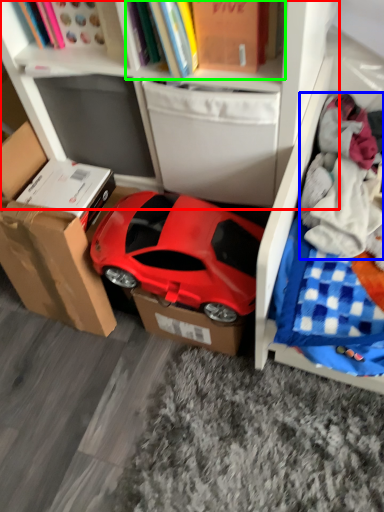
Question: Based on their relative distances, which object is farther from bookcase (highlighted by a red box)? Choose from clothing (highlighted by a blue box) and book (highlighted by a green box).

Choices:
 (A) clothing
 (B) book

Answer: (A)